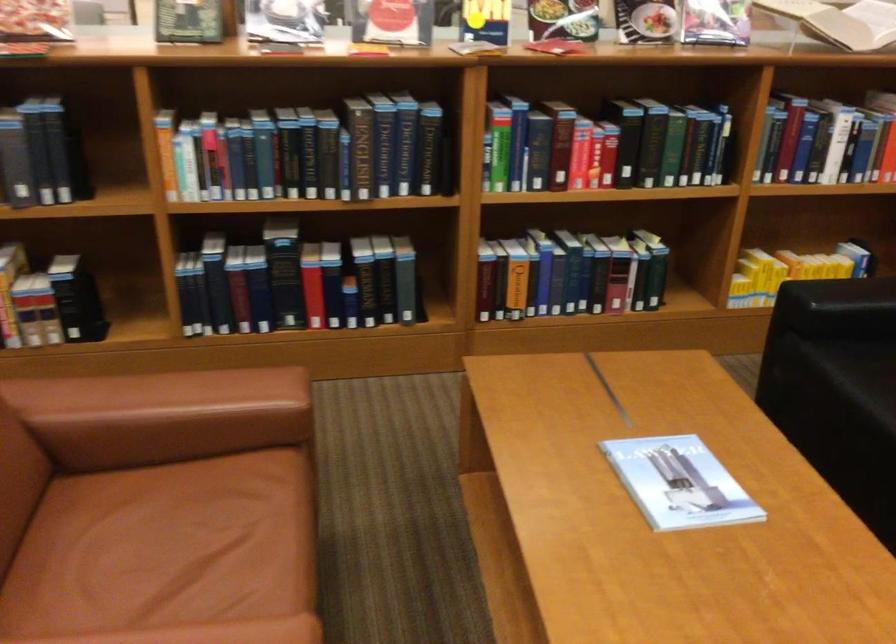
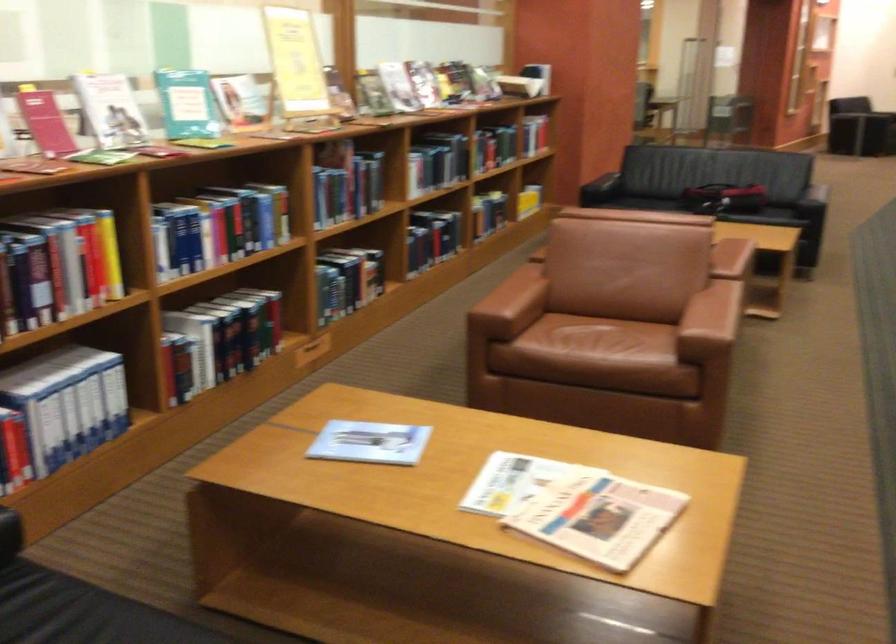
Question: I am providing you with two images of the same scene from different viewpoints. Which of the following objects are not visible in image2?

Choices:
 (A) black candlestick holder
 (B) sofa sitting surface
 (C) sofa armrest
 (D) book on shelf

Answer: (C)